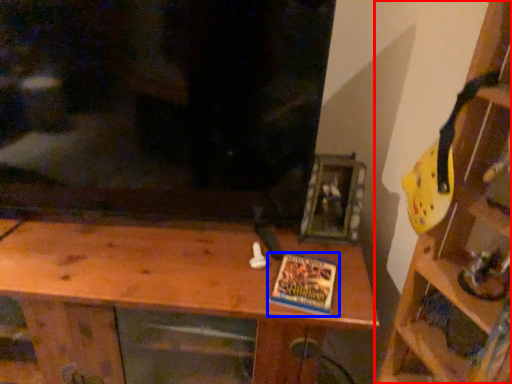
Question: Which object is closer to the camera taking this photo, shelf (highlighted by a red box) or book (highlighted by a blue box)?

Choices:
 (A) shelf
 (B) book

Answer: (A)